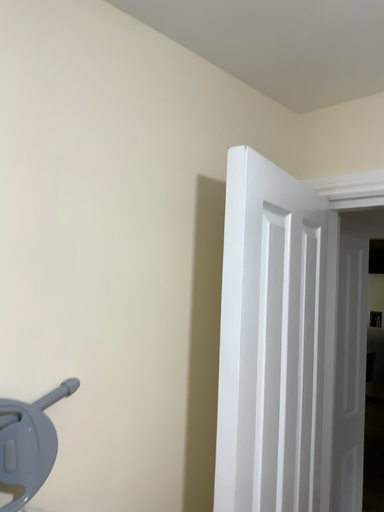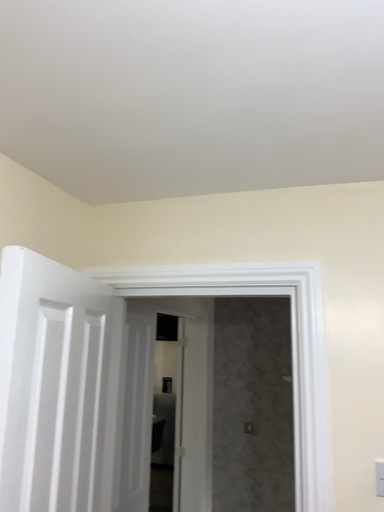
Question: Which way did the camera rotate in the video?

Choices:
 (A) rotated downward
 (B) rotated upward

Answer: (B)